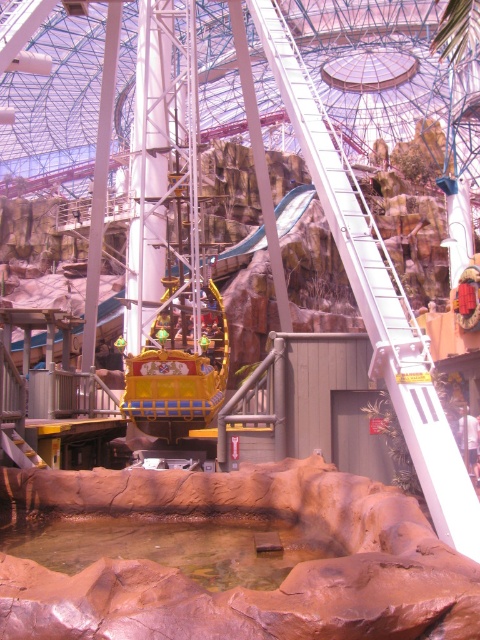
Does smooth stone water at lower center appear under shiny gold boat at center?

Yes, smooth stone water at lower center is below shiny gold boat at center.

Find the location of a particular element. smooth stone water at lower center is located at coordinates (237, 586).